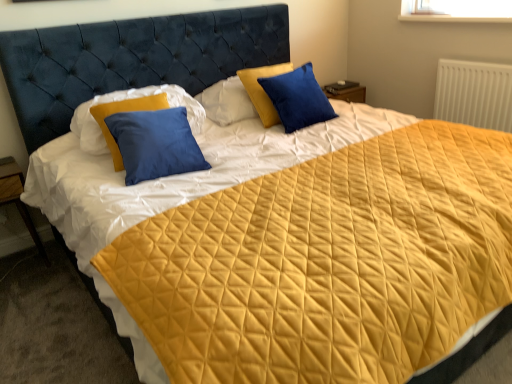
Question: From a real-world perspective, is white textured radiator at upper right located higher than blue velvet pillow at upper center, which is counted as the second pillow, starting from the left?

Choices:
 (A) no
 (B) yes

Answer: (A)

Question: Considering the relative positions of white textured radiator at upper right and blue velvet pillow at upper center, which ranks as the 1th pillow in right-to-left order, in the image provided, is white textured radiator at upper right behind blue velvet pillow at upper center, which ranks as the 1th pillow in right-to-left order,?

Choices:
 (A) no
 (B) yes

Answer: (B)

Question: Is white textured radiator at upper right positioned before blue velvet pillow at upper center, which ranks as the 1th pillow in right-to-left order?

Choices:
 (A) no
 (B) yes

Answer: (A)

Question: Could you tell me if white textured radiator at upper right is turned towards blue velvet pillow at upper center, which is counted as the second pillow, starting from the left?

Choices:
 (A) yes
 (B) no

Answer: (A)

Question: Does white textured radiator at upper right contain blue velvet pillow at upper center, which is counted as the second pillow, starting from the left?

Choices:
 (A) no
 (B) yes

Answer: (A)

Question: Would you say white textured radiator at upper right is a long distance from blue velvet pillow at upper center, which is counted as the second pillow, starting from the left?

Choices:
 (A) no
 (B) yes

Answer: (B)

Question: Is matte blue pillow at center, the second pillow from the right, facing away from white textured radiator at upper right?

Choices:
 (A) no
 (B) yes

Answer: (A)

Question: Can we say matte blue pillow at center, which is the first pillow from left to right, lies outside white textured radiator at upper right?

Choices:
 (A) no
 (B) yes

Answer: (B)

Question: Is matte blue pillow at center, the second pillow from the right, smaller than white textured radiator at upper right?

Choices:
 (A) no
 (B) yes

Answer: (A)

Question: From the image's perspective, is matte blue pillow at center, the second pillow from the right, over white textured radiator at upper right?

Choices:
 (A) yes
 (B) no

Answer: (B)

Question: Is matte blue pillow at center, the second pillow from the right, directly adjacent to white textured radiator at upper right?

Choices:
 (A) no
 (B) yes

Answer: (A)

Question: Does matte blue pillow at center, which is the first pillow from left to right, have a greater height compared to white textured radiator at upper right?

Choices:
 (A) no
 (B) yes

Answer: (B)

Question: Does matte blue pillow at center, the second pillow from the right, have a greater height compared to wooden at left?

Choices:
 (A) yes
 (B) no

Answer: (B)